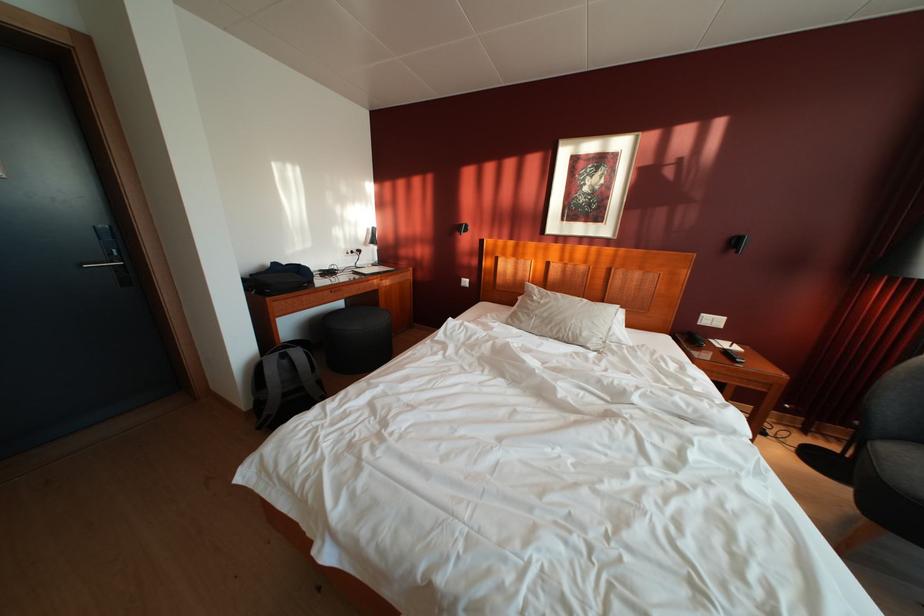
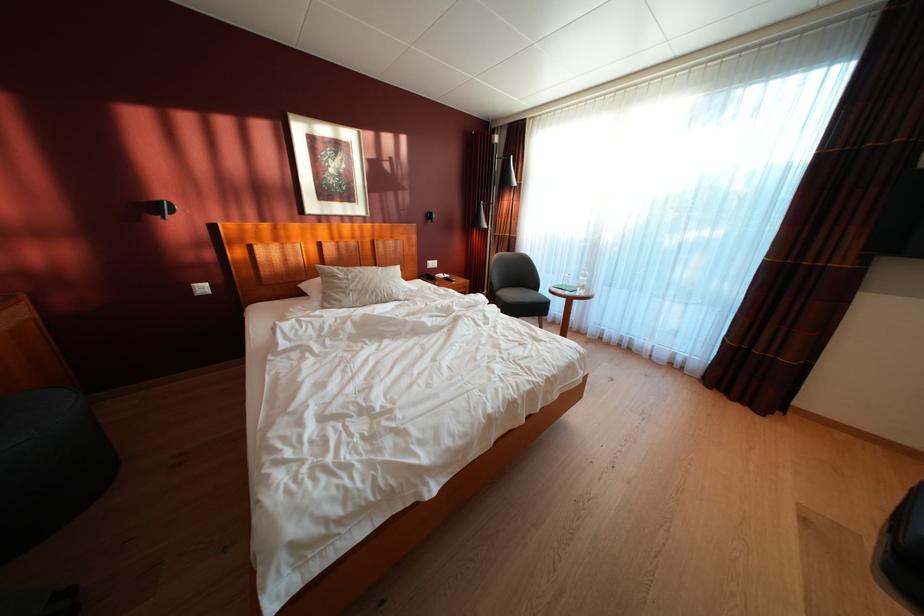
Question: The first image is from the beginning of the video and the second image is from the end. How did the camera likely rotate when shooting the video?

Choices:
 (A) Left
 (B) Right
 (C) Up
 (D) Down

Answer: (B)